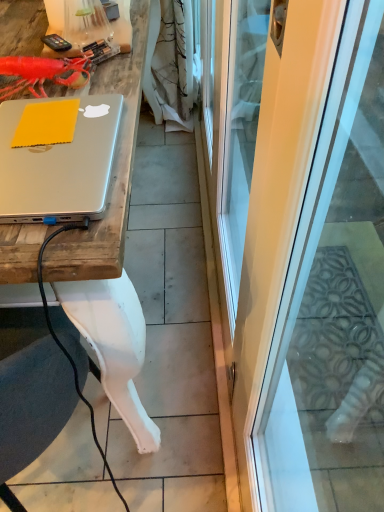
The image size is (384, 512). Describe the element at coordinates (59, 165) in the screenshot. I see `matte silver laptop at upper left` at that location.

Locate an element on the screen. The height and width of the screenshot is (512, 384). silver metallic desk at upper left is located at coordinates (110, 255).

The image size is (384, 512). What do you see at coordinates (300, 242) in the screenshot? I see `transparent glass screen door at center` at bounding box center [300, 242].

Locate an element on the screen. The image size is (384, 512). matte silver laptop at upper left is located at coordinates (59, 165).

From the image's perspective, relative to rubberized plastic lobster at upper left, is matte silver laptop at upper left above or below?

matte silver laptop at upper left is below rubberized plastic lobster at upper left.

Which of these two, matte silver laptop at upper left or rubberized plastic lobster at upper left, is smaller?

With smaller size is rubberized plastic lobster at upper left.

Considering the points (9, 193) and (70, 63), which point is behind, point (9, 193) or point (70, 63)?

The point (70, 63) is farther from the camera.

Is matte silver laptop at upper left taller or shorter than rubberized plastic lobster at upper left?

Clearly, matte silver laptop at upper left is shorter compared to rubberized plastic lobster at upper left.

Which object is positioned more to the right, silver metallic desk at upper left or matte silver laptop at upper left?

matte silver laptop at upper left is more to the right.

From the image's perspective, does silver metallic desk at upper left appear higher than matte silver laptop at upper left?

Yes, from the image's perspective, silver metallic desk at upper left is over matte silver laptop at upper left.

From a real-world perspective, who is located higher, silver metallic desk at upper left or matte silver laptop at upper left?

matte silver laptop at upper left, from a real-world perspective.

Does point (82, 251) come closer to viewer compared to point (70, 215)?

That is True.

From their relative heights in the image, would you say rubberized plastic lobster at upper left is taller or shorter than matte silver laptop at upper left?

Considering their sizes, rubberized plastic lobster at upper left has more height than matte silver laptop at upper left.

Between rubberized plastic lobster at upper left and matte silver laptop at upper left, which one appears on the left side from the viewer's perspective?

rubberized plastic lobster at upper left is more to the left.

Measure the distance from rubberized plastic lobster at upper left to matte silver laptop at upper left.

rubberized plastic lobster at upper left and matte silver laptop at upper left are 8.63 inches apart.

From the picture: Which point is more distant from viewer, (x=75, y=72) or (x=95, y=119)?

The point (x=75, y=72) is farther from the camera.

Is silver metallic desk at upper left bigger than transparent glass screen door at center?

No, silver metallic desk at upper left is not bigger than transparent glass screen door at center.

Considering the relative positions of silver metallic desk at upper left and transparent glass screen door at center in the image provided, is silver metallic desk at upper left to the left of transparent glass screen door at center from the viewer's perspective?

Yes, silver metallic desk at upper left is to the left of transparent glass screen door at center.

Is silver metallic desk at upper left looking in the opposite direction of transparent glass screen door at center?

No, silver metallic desk at upper left is not facing the opposite direction of transparent glass screen door at center.

Who is taller, rubberized plastic lobster at upper left or transparent glass screen door at center?

transparent glass screen door at center is taller.

Which point is more forward, (9, 91) or (232, 285)?

The point (9, 91) is more forward.

From the image's perspective, does rubberized plastic lobster at upper left appear higher than transparent glass screen door at center?

No, from the image's perspective, rubberized plastic lobster at upper left is not over transparent glass screen door at center.

From the image's perspective, which one is positioned higher, silver metallic desk at upper left or rubberized plastic lobster at upper left?

silver metallic desk at upper left.

Does silver metallic desk at upper left have a greater height compared to rubberized plastic lobster at upper left?

No, silver metallic desk at upper left is not taller than rubberized plastic lobster at upper left.

Locate an element on the screen. The width and height of the screenshot is (384, 512). desk that appears on the right of rubberized plastic lobster at upper left is located at coordinates (110, 255).

Is the depth of silver metallic desk at upper left less than that of rubberized plastic lobster at upper left?

No, the depth of silver metallic desk at upper left is greater than that of rubberized plastic lobster at upper left.

Which is in front, transparent glass screen door at center or rubberized plastic lobster at upper left?

transparent glass screen door at center is closer to the camera.

Does point (315, 120) appear closer or farther from the camera than point (89, 73)?

Point (315, 120).

In terms of width, does transparent glass screen door at center look wider or thinner when compared to rubberized plastic lobster at upper left?

Clearly, transparent glass screen door at center has less width compared to rubberized plastic lobster at upper left.

Is transparent glass screen door at center far away from rubberized plastic lobster at upper left?

Actually, transparent glass screen door at center and rubberized plastic lobster at upper left are a little close together.

This screenshot has height=512, width=384. I want to click on lobster positioned vertically above the matte silver laptop at upper left (from a real-world perspective), so click(43, 73).

This screenshot has width=384, height=512. Identify the location of desk below the matte silver laptop at upper left (from a real-world perspective). (110, 255).

Looking at the image, which one is located further to transparent glass screen door at center, matte silver laptop at upper left or rubberized plastic lobster at upper left?

rubberized plastic lobster at upper left is further to transparent glass screen door at center.

When comparing their distances from rubberized plastic lobster at upper left, does transparent glass screen door at center or silver metallic desk at upper left seem further?

Based on the image, transparent glass screen door at center appears to be further to rubberized plastic lobster at upper left.

Estimate the real-world distances between objects in this image. Which object is closer to rubberized plastic lobster at upper left, matte silver laptop at upper left or transparent glass screen door at center?

matte silver laptop at upper left lies closer to rubberized plastic lobster at upper left than the other object.

Which object lies further to the anchor point transparent glass screen door at center, silver metallic desk at upper left or rubberized plastic lobster at upper left?

rubberized plastic lobster at upper left is positioned further to the anchor transparent glass screen door at center.

Considering their positions, is rubberized plastic lobster at upper left positioned further to silver metallic desk at upper left than transparent glass screen door at center?

transparent glass screen door at center lies further to silver metallic desk at upper left than the other object.

Based on the photo, which object lies further to the anchor point transparent glass screen door at center, rubberized plastic lobster at upper left or matte silver laptop at upper left?

rubberized plastic lobster at upper left is positioned further to the anchor transparent glass screen door at center.

Based on their spatial positions, is matte silver laptop at upper left or silver metallic desk at upper left closer to rubberized plastic lobster at upper left?

matte silver laptop at upper left is positioned closer to the anchor rubberized plastic lobster at upper left.

Considering their positions, is rubberized plastic lobster at upper left positioned further to matte silver laptop at upper left than transparent glass screen door at center?

The object further to matte silver laptop at upper left is transparent glass screen door at center.

This screenshot has width=384, height=512. Find the location of `laptop positioned between transparent glass screen door at center and rubberized plastic lobster at upper left from near to far`. laptop positioned between transparent glass screen door at center and rubberized plastic lobster at upper left from near to far is located at coordinates (59, 165).

Where is `lobster positioned between transparent glass screen door at center and silver metallic desk at upper left from near to far`? lobster positioned between transparent glass screen door at center and silver metallic desk at upper left from near to far is located at coordinates click(43, 73).

Locate an element on the screen. lobster between silver metallic desk at upper left and matte silver laptop at upper left vertically is located at coordinates (43, 73).

Where is `laptop between transparent glass screen door at center and silver metallic desk at upper left in the front-back direction`? The height and width of the screenshot is (512, 384). laptop between transparent glass screen door at center and silver metallic desk at upper left in the front-back direction is located at coordinates (59, 165).